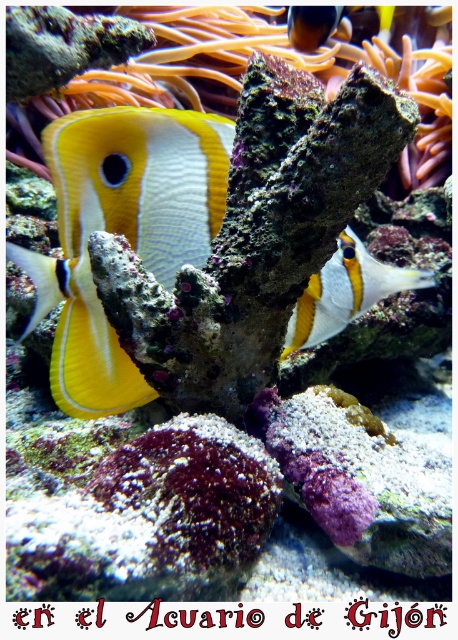
Who is positioned more to the right, yellow matte butterflyfish at center or yellow and white coral-like fish at center?

yellow and white coral-like fish at center is more to the right.

Does point (197, 166) lie in front of point (430, 280)?

Yes, point (197, 166) is closer to viewer.

I want to click on yellow matte butterflyfish at center, so click(x=121, y=232).